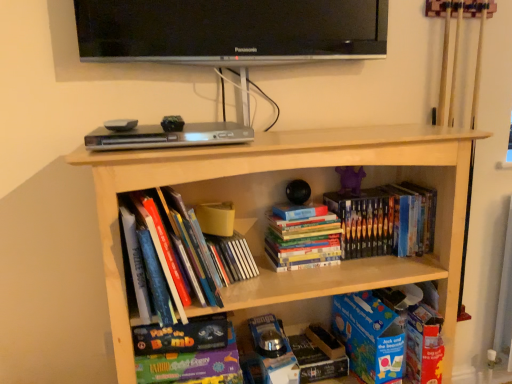
Question: In the image, is hardcover books at center, the third book in the left-to-right sequence, on the left side or the right side of purple matte toy at center?

Choices:
 (A) right
 (B) left

Answer: (B)

Question: In terms of width, does hardcover books at center, arranged as the second book when viewed from the right, look wider or thinner when compared to purple matte toy at center?

Choices:
 (A) wide
 (B) thin

Answer: (A)

Question: Which is nearer to the matte board game at lower center, which is the 3th book in right-to-left order?

Choices:
 (A) hardcover books at center, arranged as the second book when viewed from the right
 (B) hardcover books at center, arranged as the first book when viewed from the right
 (C) hardcover books at center, which is the 4th book in right-to-left order
 (D) light wood bookcase at center
 (E) purple matte toy at center

Answer: (C)

Question: Which object is positioned farthest from the purple matte toy at center?

Choices:
 (A) black glossy television at upper center
 (B) hardcover books at center, arranged as the first book when viewed from the right
 (C) hardcover books at center, the third book in the left-to-right sequence
 (D) hardcover books at center, which is the 4th book in right-to-left order
 (E) light wood bookcase at center

Answer: (D)